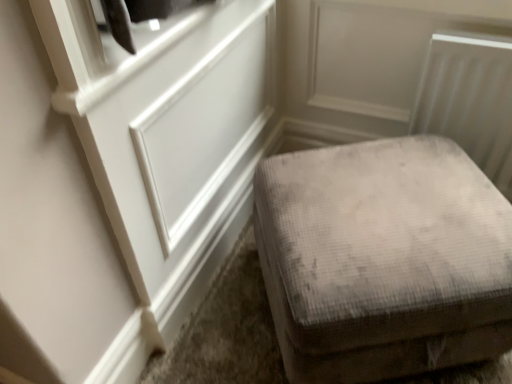
Measure the distance between white paneling at upper left and camera.

The depth of white paneling at upper left is 24.17 inches.

What do you see at coordinates (166, 122) in the screenshot? I see `white paneling at upper left` at bounding box center [166, 122].

Identify the location of white paneling at upper left. (166, 122).

This screenshot has height=384, width=512. Identify the location of gray velvety ottoman at lower right. (383, 259).

What do you see at coordinates (383, 259) in the screenshot? I see `gray velvety ottoman at lower right` at bounding box center [383, 259].

The image size is (512, 384). I want to click on white paneling at upper left, so click(x=166, y=122).

Considering the positions of objects gray velvety ottoman at lower right and white paneling at upper left in the image provided, who is more to the right, gray velvety ottoman at lower right or white paneling at upper left?

Positioned to the right is gray velvety ottoman at lower right.

Looking at this image, does gray velvety ottoman at lower right lie behind white paneling at upper left?

Yes, gray velvety ottoman at lower right is further from the viewer.

Which is farther from the camera, (267, 170) or (257, 107)?

The point (257, 107) is behind.

From the image's perspective, who appears lower, gray velvety ottoman at lower right or white paneling at upper left?

From the image's view, gray velvety ottoman at lower right is below.

From a real-world perspective, who is located lower, gray velvety ottoman at lower right or white paneling at upper left?

gray velvety ottoman at lower right.

Does gray velvety ottoman at lower right have a greater width compared to white paneling at upper left?

Correct, the width of gray velvety ottoman at lower right exceeds that of white paneling at upper left.

Does gray velvety ottoman at lower right have a greater height compared to white paneling at upper left?

Incorrect, the height of gray velvety ottoman at lower right is not larger of that of white paneling at upper left.

Can you confirm if gray velvety ottoman at lower right is bigger than white paneling at upper left?

Indeed, gray velvety ottoman at lower right has a larger size compared to white paneling at upper left.

Is white paneling at upper left a part of gray velvety ottoman at lower right?

No.

Is gray velvety ottoman at lower right not close to white paneling at upper left?

No, gray velvety ottoman at lower right is not far away from white paneling at upper left.

Based on the photo, could you tell me if gray velvety ottoman at lower right is facing white paneling at upper left?

No, gray velvety ottoman at lower right does not turn towards white paneling at upper left.

How many degrees apart are the facing directions of gray velvety ottoman at lower right and white paneling at upper left?

They differ by 55.3 degrees in their facing directions.

Looking at this image, measure the distance between gray velvety ottoman at lower right and white paneling at upper left.

gray velvety ottoman at lower right and white paneling at upper left are 18.17 inches apart.

The height and width of the screenshot is (384, 512). In order to click on furniture that appears on the right of white paneling at upper left in this screenshot , I will do `click(383, 259)`.

In the image, is white paneling at upper left on the left side or the right side of gray velvety ottoman at lower right?

From the image, it's evident that white paneling at upper left is to the left of gray velvety ottoman at lower right.

Does white paneling at upper left lie in front of gray velvety ottoman at lower right?

Yes, white paneling at upper left is closer to the viewer.

Which is more distant, [270,99] or [362,292]?

Point [270,99]

From the image's perspective, relative to gray velvety ottoman at lower right, is white paneling at upper left above or below?

white paneling at upper left is above gray velvety ottoman at lower right.

From a real-world perspective, between white paneling at upper left and gray velvety ottoman at lower right, who is vertically lower?

gray velvety ottoman at lower right, from a real-world perspective.

Does white paneling at upper left have a greater width compared to gray velvety ottoman at lower right?

In fact, white paneling at upper left might be narrower than gray velvety ottoman at lower right.

Between white paneling at upper left and gray velvety ottoman at lower right, which one has less height?

gray velvety ottoman at lower right is shorter.

Who is bigger, white paneling at upper left or gray velvety ottoman at lower right?

With larger size is gray velvety ottoman at lower right.

Would you say white paneling at upper left is outside gray velvety ottoman at lower right?

white paneling at upper left lies outside gray velvety ottoman at lower right's area.

Is white paneling at upper left placed right next to gray velvety ottoman at lower right?

No, white paneling at upper left is not next to gray velvety ottoman at lower right.

Is white paneling at upper left facing towards gray velvety ottoman at lower right?

Yes.

Can you tell me how much white paneling at upper left and gray velvety ottoman at lower right differ in facing direction?

The angular difference between white paneling at upper left and gray velvety ottoman at lower right is 55.3 degrees.

Identify the location of furniture below the white paneling at upper left (from a real-world perspective). (383, 259).

Find the location of a particular element. furniture lying on the right of white paneling at upper left is located at coordinates (383, 259).

This screenshot has width=512, height=384. Identify the location of door above the gray velvety ottoman at lower right (from a real-world perspective). (166, 122).